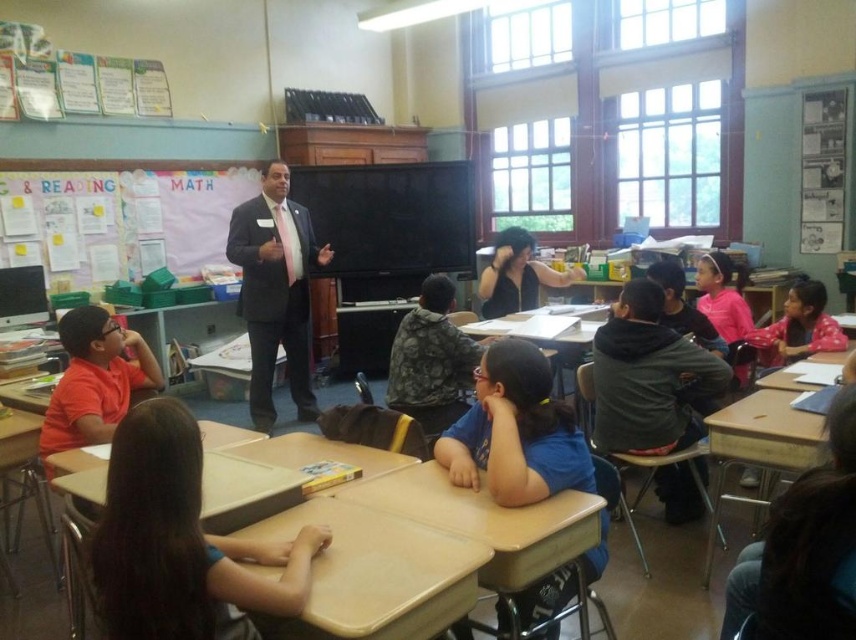
You are a student sitting at the back of the classroom. You need to hand in a paper to the teacher who is standing near the front. The tan matte table at center and the pink cotton shirt at right are in your line of sight. Which object should you walk towards first to reach the teacher?

You should walk towards the pink cotton shirt at right first because the tan matte table at center is positioned on the left side of the pink cotton shirt at right, meaning the pink cotton shirt at right is closer to the front of the classroom where the teacher is standing.

You are a student sitting at the light brown wood desk at center. You want to hand a paper to the dark suit at center. Can you do so without leaving your seat?

The light brown wood desk at center is in front of the dark suit at center, so you can hand the paper to the dark suit at center without leaving your seat by reaching forward.